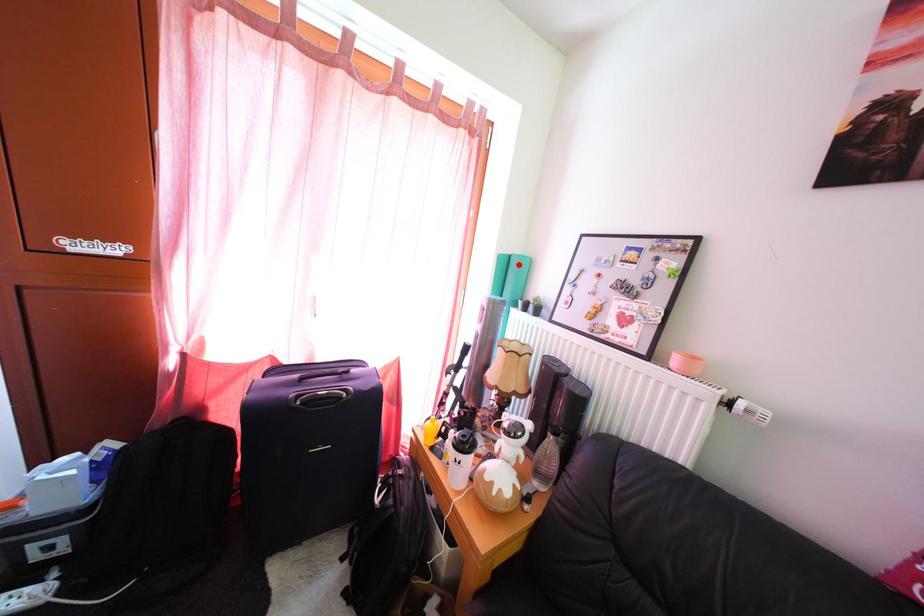
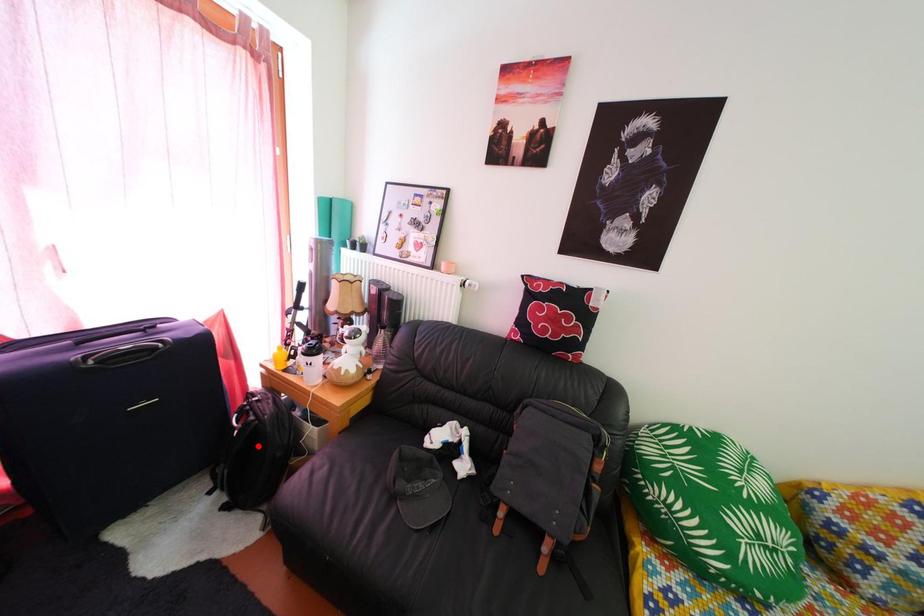
I am providing you with two images of the same scene from different viewpoints. A red point is marked on the first image and another point is marked on the second image. Is the red point in image1 aligned with the point shown in image2?

No